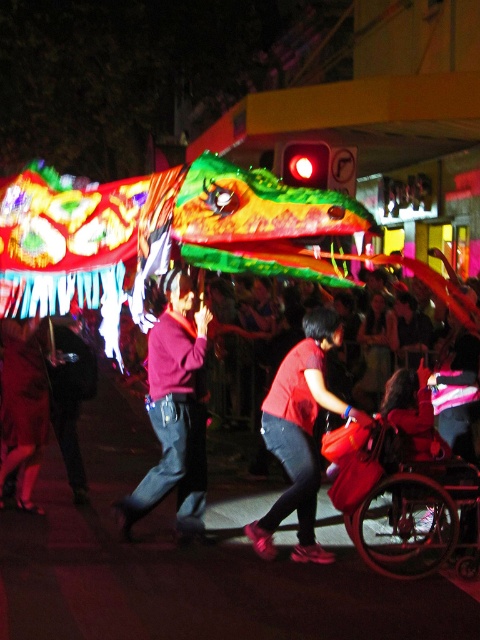
You are at the center of the scene and want to find the matte red sweater at center. Which direction should you look to locate it?

You should look directly ahead since the matte red sweater at center is positioned at the center of the scene.

In the scene shown: You are attending the nighttime parade and want to take a photo of the dragon lantern. You have a metallic red wheelchair at lower right and a person in a matte red shirt at center in your view. Which object is closer to you, the wheelchair or the person?

The metallic red wheelchair at lower right is positioned under the matte red shirt at center, meaning the wheelchair is closer to you than the person in the matte red shirt at center.